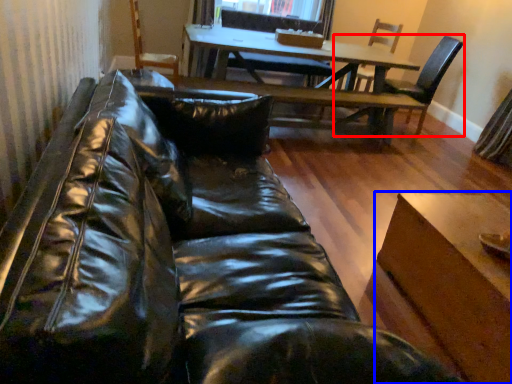
Question: Which of the following is the farthest to the observer, chair (highlighted by a red box) or table (highlighted by a blue box)?

Choices:
 (A) chair
 (B) table

Answer: (A)